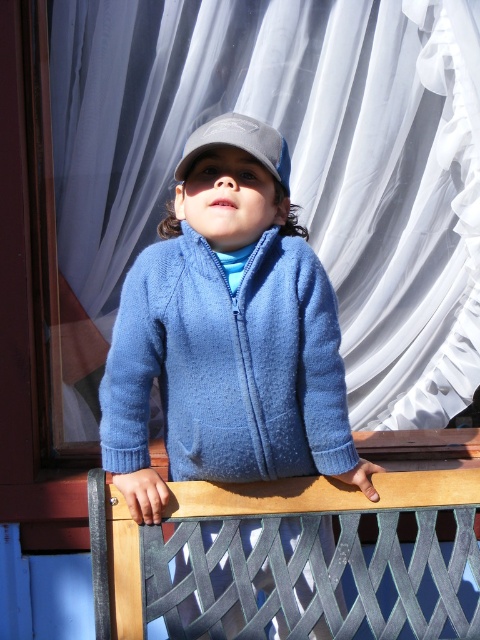
You are a photographer trying to capture the child in the scene. The blue fuzzy jacket at center is at point (228, 364). Where should you position your camera to ensure the blue fuzzy jacket at center is in the center of your photo?

Position your camera so that the lens is aligned with the coordinates (228, 364) to center the blue fuzzy jacket at center in your photo.